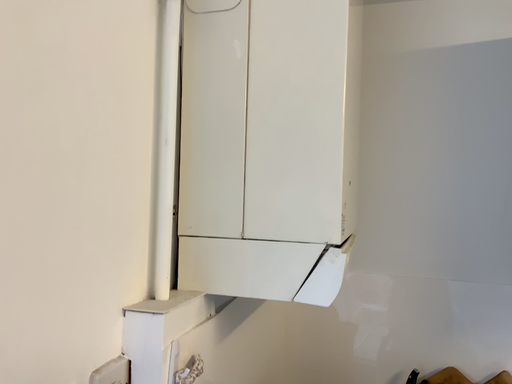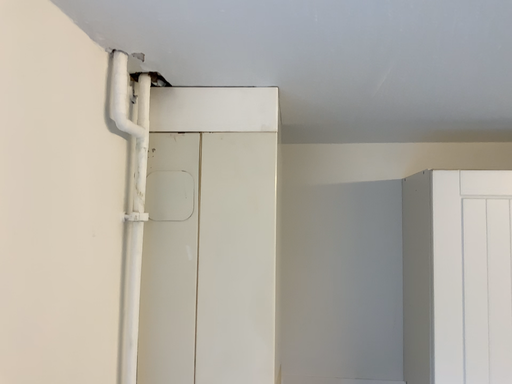
Question: Which way did the camera rotate in the video?

Choices:
 (A) rotated right
 (B) rotated left

Answer: (A)